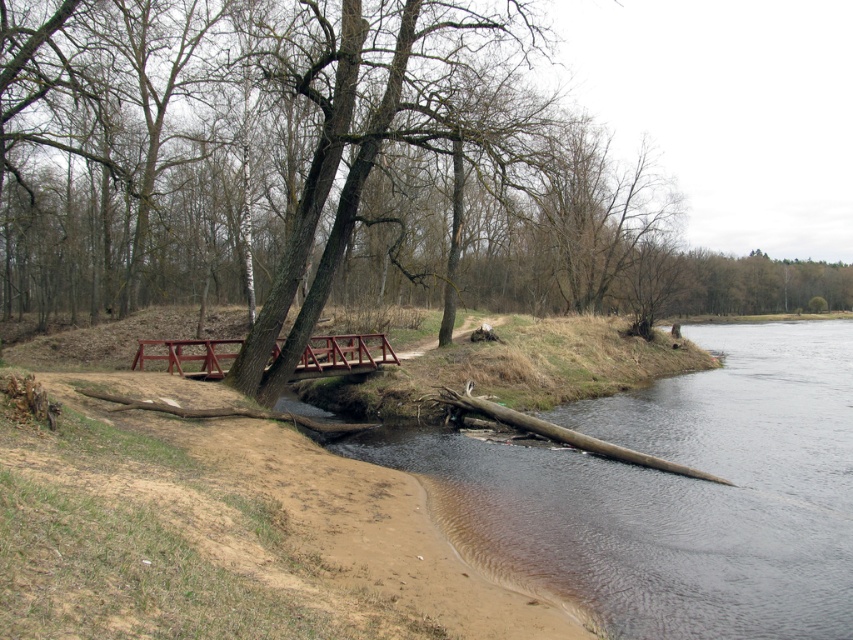
Which is behind, point (370, 333) or point (670, 461)?

The point (370, 333) is behind.

Can you confirm if metallic red bridge at center is positioned to the right of brown wood log at lower right?

Incorrect, metallic red bridge at center is not on the right side of brown wood log at lower right.

Locate an element on the screen. Image resolution: width=853 pixels, height=640 pixels. metallic red bridge at center is located at coordinates (343, 355).